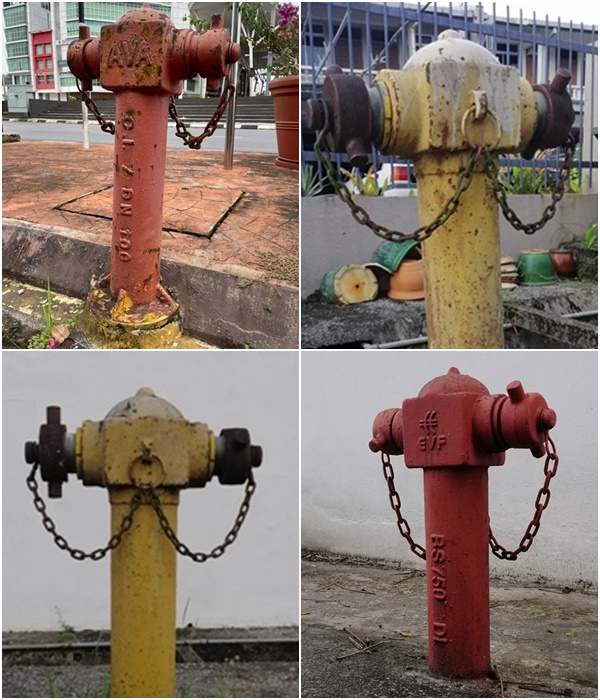
Find the location of a particular element. This screenshot has height=700, width=600. windows is located at coordinates (99, 17).